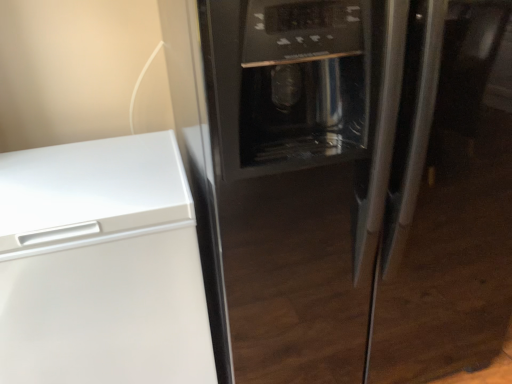
Question: Can you confirm if black glass refrigerator at center is shorter than white matte freezer at left?

Choices:
 (A) no
 (B) yes

Answer: (A)

Question: Does black glass refrigerator at center touch white matte freezer at left?

Choices:
 (A) no
 (B) yes

Answer: (A)

Question: Can you confirm if black glass refrigerator at center is thinner than white matte freezer at left?

Choices:
 (A) no
 (B) yes

Answer: (A)

Question: Is black glass refrigerator at center positioned with its back to white matte freezer at left?

Choices:
 (A) yes
 (B) no

Answer: (B)

Question: Can you confirm if black glass refrigerator at center is positioned to the left of white matte freezer at left?

Choices:
 (A) no
 (B) yes

Answer: (A)

Question: Can white matte freezer at left be found inside black glass refrigerator at center?

Choices:
 (A) yes
 (B) no

Answer: (B)

Question: Considering the relative positions of white matte freezer at left and black glass refrigerator at center in the image provided, is white matte freezer at left to the left of black glass refrigerator at center from the viewer's perspective?

Choices:
 (A) no
 (B) yes

Answer: (B)

Question: Considering the relative sizes of white matte freezer at left and black glass refrigerator at center in the image provided, is white matte freezer at left bigger than black glass refrigerator at center?

Choices:
 (A) yes
 (B) no

Answer: (B)

Question: Is white matte freezer at left facing towards black glass refrigerator at center?

Choices:
 (A) no
 (B) yes

Answer: (A)

Question: From a real-world perspective, is white matte freezer at left under black glass refrigerator at center?

Choices:
 (A) yes
 (B) no

Answer: (A)

Question: Is black glass refrigerator at center inside white matte freezer at left?

Choices:
 (A) yes
 (B) no

Answer: (B)

Question: Is white matte freezer at left not near black glass refrigerator at center?

Choices:
 (A) yes
 (B) no

Answer: (B)

Question: Considering the positions of white matte freezer at left and black glass refrigerator at center in the image, is white matte freezer at left taller or shorter than black glass refrigerator at center?

Choices:
 (A) tall
 (B) short

Answer: (B)